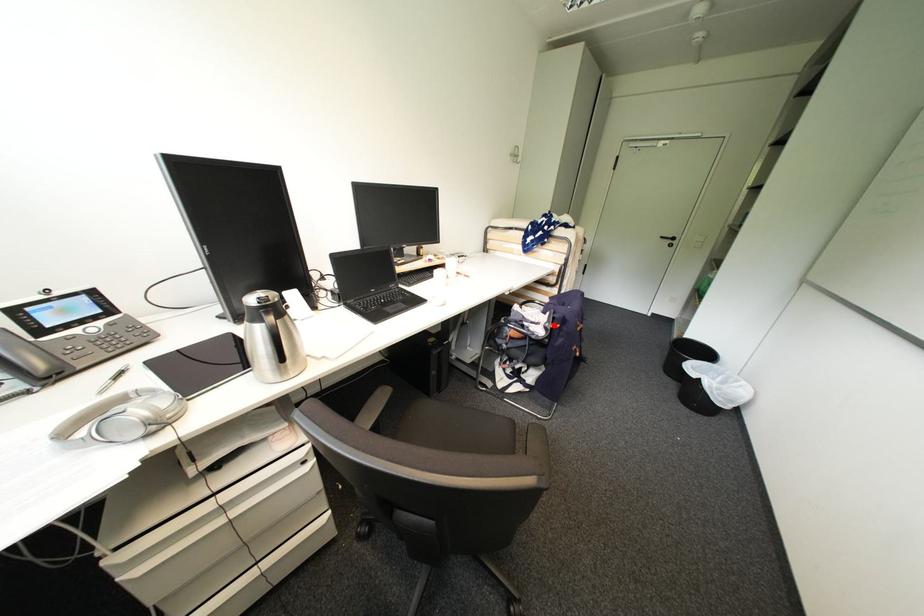
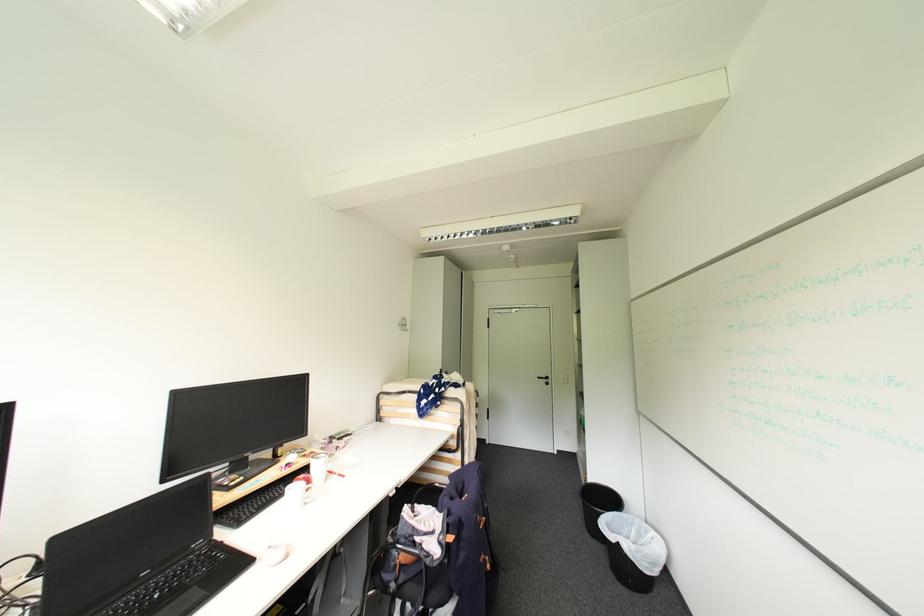
Question: I am providing you with two images of the same scene from different viewpoints. Given a red point in image1, look at the same physical point in image2. Is it:

Choices:
 (A) Closer to the viewpoint
 (B) Farther from the viewpoint

Answer: (B)